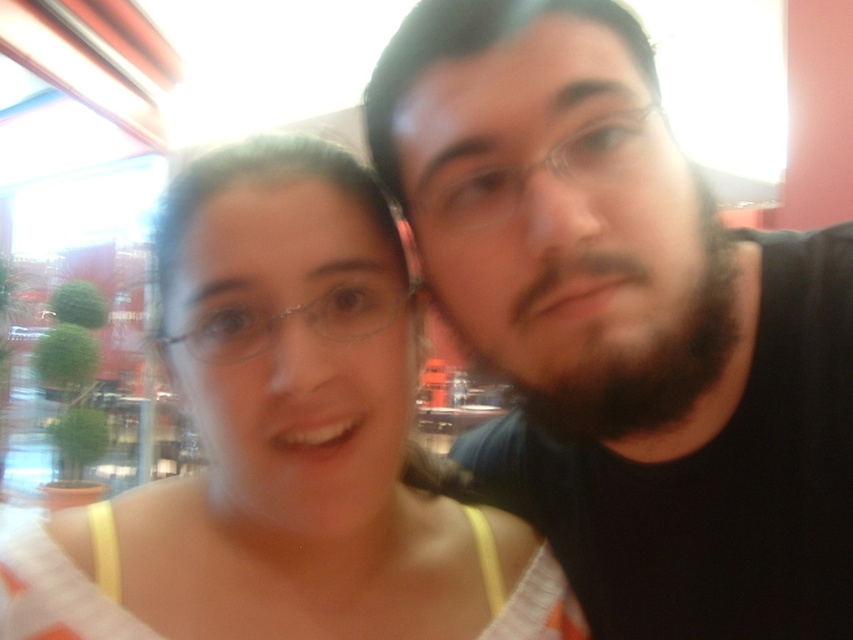
You are a photographer trying to capture a clear photo of both the black matte shirt at right and the matte white tank top at center. Since you can only focus on one object at a time, which one should you focus on to ensure the other remains in the background?

You should focus on the black matte shirt at right because it is closer to the viewer than the matte white tank top at center. When focused on the closer object, the farther one will naturally appear in the background.

You are a photographer adjusting the framing of a portrait. The subject is the black matte shirt at right. Where should you position your camera to capture the shirt in the center of the frame?

To center the black matte shirt at right in the frame, position the camera so that its center aligns with the coordinates provided in the description, which are at point (x=624, y=324).

You are a fashion designer observing two people in the image. The black matte shirt at right and the matte white tank top at center are both visible. Which clothing item appears narrower in width?

The black matte shirt at right is thinner than the matte white tank top at center, so the black matte shirt at right appears narrower in width.